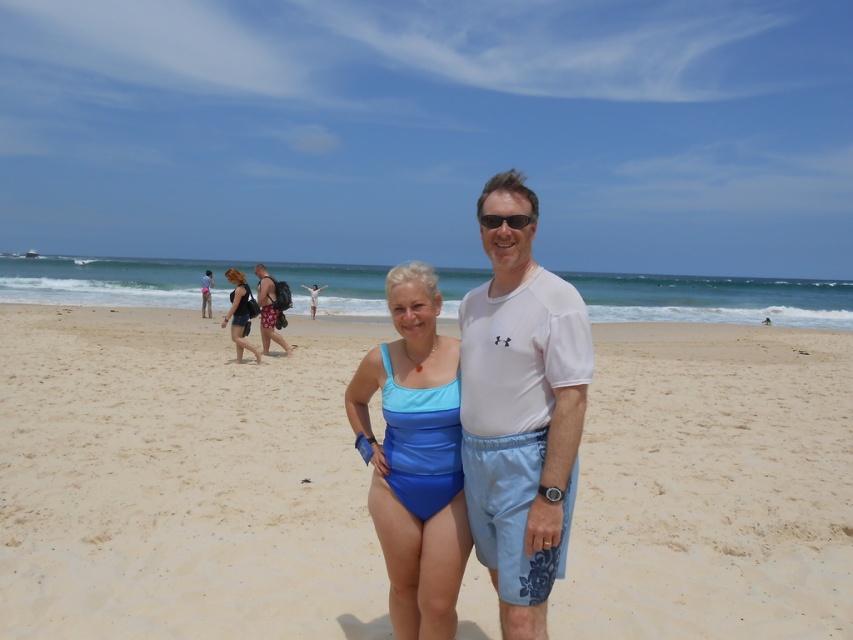
Can you confirm if white matte t-shirt at center is thinner than blue fabric swimsuit at center?

Yes, white matte t-shirt at center is thinner than blue fabric swimsuit at center.

Between white matte t-shirt at center and blue fabric swimsuit at center, which one appears on the right side from the viewer's perspective?

white matte t-shirt at center is more to the right.

Which is behind, point (482, 403) or point (262, 321)?

The point (262, 321) is behind.

What are the coordinates of `white matte t-shirt at center` in the screenshot? It's located at (521, 422).

Does matte black swimsuit at center have a smaller size compared to blue fabric swimsuit at center?

Actually, matte black swimsuit at center might be larger than blue fabric swimsuit at center.

Does matte black swimsuit at center lie in front of blue fabric swimsuit at center?

Yes, it is in front of blue fabric swimsuit at center.

Does point (244, 282) come in front of point (270, 280)?

Yes, point (244, 282) is closer to viewer.

I want to click on matte black swimsuit at center, so click(238, 314).

Does white sand at center appear on the right side of blue fabric swimsuit at center?

Correct, you'll find white sand at center to the right of blue fabric swimsuit at center.

Who is shorter, white sand at center or blue fabric swimsuit at center?

Standing shorter between the two is white sand at center.

Who is more forward, [595,464] or [264,298]?

Point [595,464] is more forward.

Locate an element on the screen. The width and height of the screenshot is (853, 640). white sand at center is located at coordinates (178, 481).